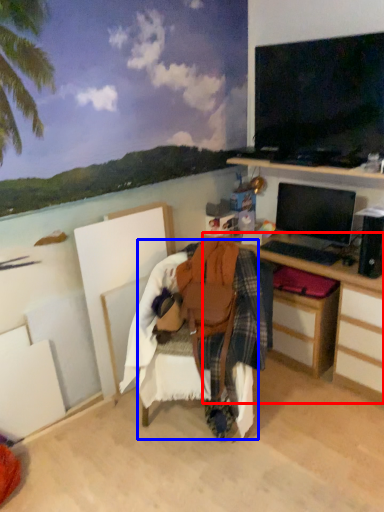
Question: Which object is closer to the camera taking this photo, desk (highlighted by a red box) or chair (highlighted by a blue box)?

Choices:
 (A) desk
 (B) chair

Answer: (B)